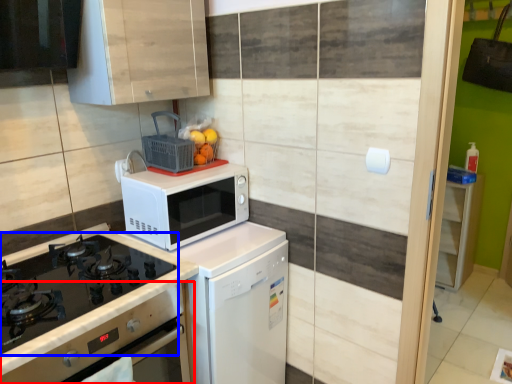
Question: Which object appears farthest to the camera in this image, oven (highlighted by a red box) or gas stove (highlighted by a blue box)?

Choices:
 (A) oven
 (B) gas stove

Answer: (B)